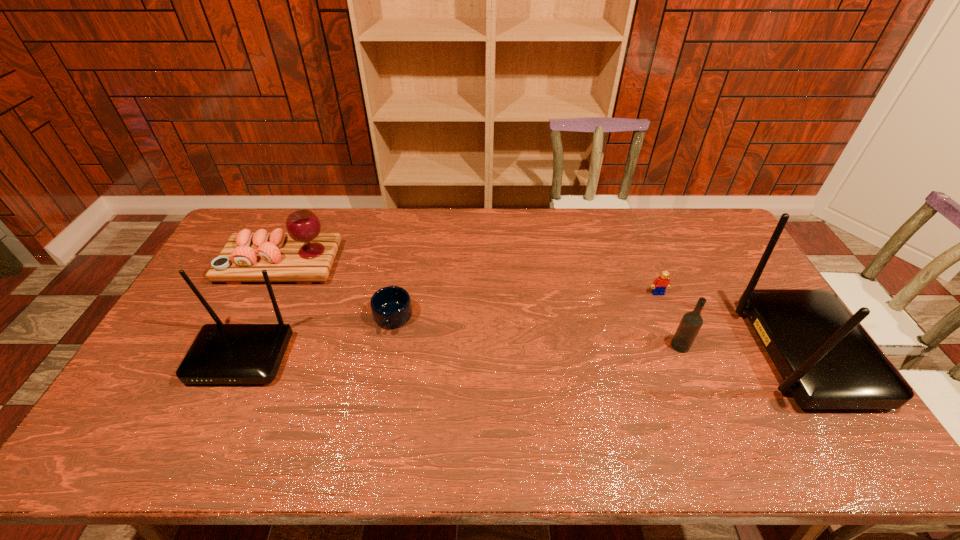
I want to click on object present at the near left corner, so click(x=221, y=353).

This screenshot has width=960, height=540. What are the coordinates of `object located at the near right corner` in the screenshot? It's located at (827, 360).

Locate an element on the screen. The image size is (960, 540). vacant space at the far edge of the desktop is located at coordinates 454,238.

The width and height of the screenshot is (960, 540). Identify the location of vacant space at the near edge of the desktop. (492, 417).

At what (x,y) coordinates should I click in order to perform the action: click on free space at the left edge. Please return your answer as a coordinate pair (x, y). The image size is (960, 540). Looking at the image, I should click on (228, 322).

Image resolution: width=960 pixels, height=540 pixels. In order to click on blank area at the right edge in this screenshot , I will do `click(719, 259)`.

What are the coordinates of `free spot at the far left corner of the desktop` in the screenshot? It's located at (269, 214).

Locate an element on the screen. The image size is (960, 540). free space between the shortest object and the left router is located at coordinates (318, 337).

Where is `free spot between the Lego and the taller router`? The width and height of the screenshot is (960, 540). free spot between the Lego and the taller router is located at coordinates (732, 323).

The image size is (960, 540). Find the location of `free spot between the tallest object and the fourth object from right to left`. free spot between the tallest object and the fourth object from right to left is located at coordinates (599, 335).